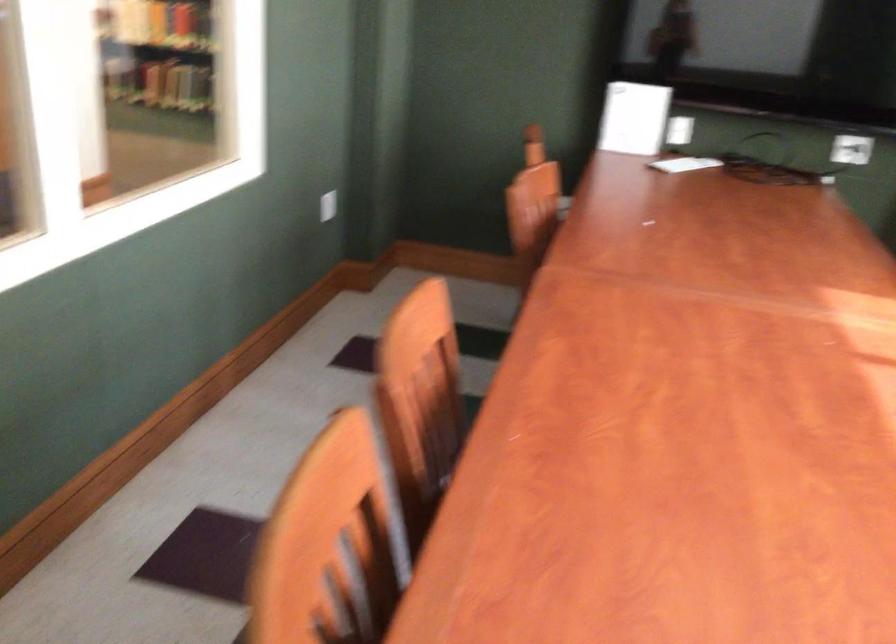
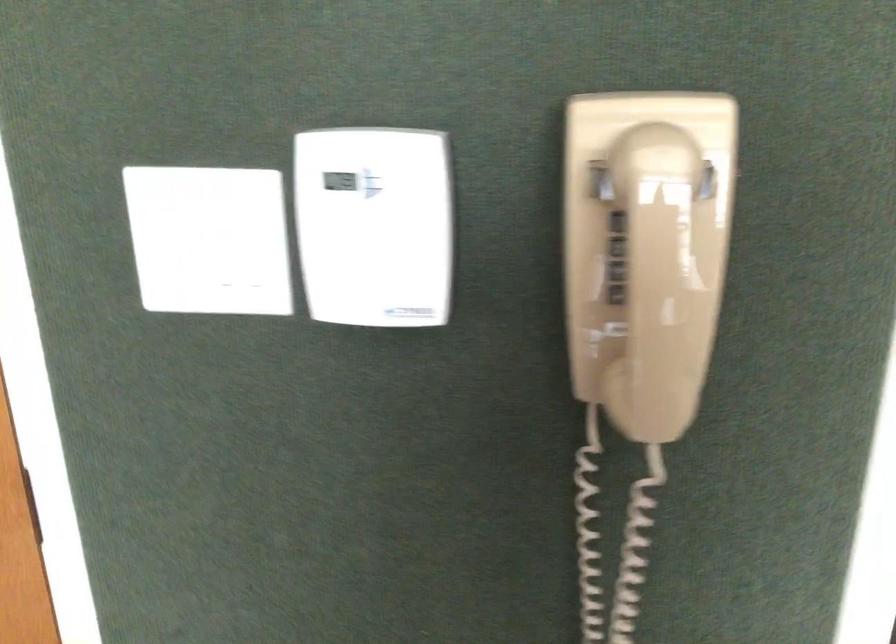
Question: Based on the continuous images, in which direction is the camera rotating? Reply with the corresponding letter.

Choices:
 (A) Left
 (B) Right
 (C) Up
 (D) Down

Answer: (A)